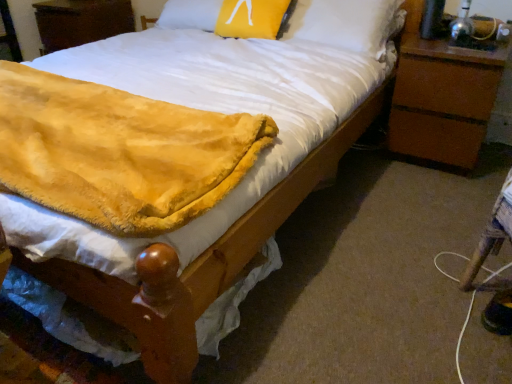
The image size is (512, 384). Describe the element at coordinates (119, 152) in the screenshot. I see `fuzzy yellow blanket at lower left` at that location.

Where is `yellow fuzzy pillow at upper center`? This screenshot has height=384, width=512. yellow fuzzy pillow at upper center is located at coordinates (253, 18).

The height and width of the screenshot is (384, 512). What do you see at coordinates (442, 96) in the screenshot? I see `brown wood nightstand at right, placed as the second nightstand when sorted from back to front` at bounding box center [442, 96].

Locate an element on the screen. The image size is (512, 384). wooden nightstand at upper left, the 1th nightstand viewed from the back is located at coordinates (81, 21).

Considering the sizes of objects brown wood nightstand at right, marked as the 1th nightstand in a bottom-to-top arrangement, and wooden nightstand at upper left, the second nightstand in the bottom-to-top sequence, in the image provided, who is thinner, brown wood nightstand at right, marked as the 1th nightstand in a bottom-to-top arrangement, or wooden nightstand at upper left, the second nightstand in the bottom-to-top sequence,?

brown wood nightstand at right, marked as the 1th nightstand in a bottom-to-top arrangement.

At what (x,y) coordinates should I click in order to perform the action: click on nightstand located behind the brown wood nightstand at right, arranged as the 2th nightstand when viewed from the top. Please return your answer as a coordinate pair (x, y). Looking at the image, I should click on click(81, 21).

Is brown wood nightstand at right, marked as the 1th nightstand in a bottom-to-top arrangement, facing away from wooden nightstand at upper left, the second nightstand in the bottom-to-top sequence?

brown wood nightstand at right, marked as the 1th nightstand in a bottom-to-top arrangement, is not turned away from wooden nightstand at upper left, the second nightstand in the bottom-to-top sequence.

Are brown wood nightstand at right, which is counted as the second nightstand, starting from the left, and wooden nightstand at upper left, positioned as the first nightstand in top-to-bottom order, beside each other?

No, brown wood nightstand at right, which is counted as the second nightstand, starting from the left, is not in contact with wooden nightstand at upper left, positioned as the first nightstand in top-to-bottom order.

From a real-world perspective, is brown wood nightstand at right, arranged as the 2th nightstand when viewed from the top, under fuzzy yellow blanket at lower left?

Yes, from a real-world perspective, brown wood nightstand at right, arranged as the 2th nightstand when viewed from the top, is below fuzzy yellow blanket at lower left.

Is brown wood nightstand at right, arranged as the 2th nightstand when viewed from the top, facing away from fuzzy yellow blanket at lower left?

brown wood nightstand at right, arranged as the 2th nightstand when viewed from the top, does not have its back to fuzzy yellow blanket at lower left.

Based on the photo, what's the angular difference between brown wood nightstand at right, marked as the 1th nightstand in a bottom-to-top arrangement, and fuzzy yellow blanket at lower left's facing directions?

There is a 0.19-degree angle between the facing directions of brown wood nightstand at right, marked as the 1th nightstand in a bottom-to-top arrangement, and fuzzy yellow blanket at lower left.

Considering the relative positions of brown wood nightstand at right, arranged as the 2th nightstand when viewed from the top, and fuzzy yellow blanket at lower left in the image provided, is brown wood nightstand at right, arranged as the 2th nightstand when viewed from the top, to the left of fuzzy yellow blanket at lower left from the viewer's perspective?

In fact, brown wood nightstand at right, arranged as the 2th nightstand when viewed from the top, is to the right of fuzzy yellow blanket at lower left.

Can you confirm if brown wood nightstand at right, marked as the 1th nightstand in a bottom-to-top arrangement, is wider than yellow fuzzy pillow at upper center?

Correct, the width of brown wood nightstand at right, marked as the 1th nightstand in a bottom-to-top arrangement, exceeds that of yellow fuzzy pillow at upper center.

Who is shorter, brown wood nightstand at right, acting as the 1th nightstand starting from the front, or yellow fuzzy pillow at upper center?

yellow fuzzy pillow at upper center is shorter.

From the picture: Is brown wood nightstand at right, acting as the 1th nightstand starting from the front, touching yellow fuzzy pillow at upper center?

No, brown wood nightstand at right, acting as the 1th nightstand starting from the front, is not with yellow fuzzy pillow at upper center.

Is wooden nightstand at upper left, the 1th nightstand viewed from the back, positioned behind fuzzy yellow blanket at lower left?

Yes, it is behind fuzzy yellow blanket at lower left.

From the image's perspective, is wooden nightstand at upper left, the second nightstand in the bottom-to-top sequence, located above or below fuzzy yellow blanket at lower left?

Clearly, from the image's perspective, wooden nightstand at upper left, the second nightstand in the bottom-to-top sequence, is above fuzzy yellow blanket at lower left.

Is wooden nightstand at upper left, the 1th nightstand viewed from the back, next to fuzzy yellow blanket at lower left?

No, wooden nightstand at upper left, the 1th nightstand viewed from the back, is not touching fuzzy yellow blanket at lower left.

Based on the photo, is wooden nightstand at upper left, the second nightstand in the bottom-to-top sequence, oriented towards fuzzy yellow blanket at lower left?

No, wooden nightstand at upper left, the second nightstand in the bottom-to-top sequence, is not aimed at fuzzy yellow blanket at lower left.

Is fuzzy yellow blanket at lower left turned away from wooden nightstand at upper left, positioned as the first nightstand in top-to-bottom order?

No.

Which of these two, fuzzy yellow blanket at lower left or wooden nightstand at upper left, the second nightstand in the bottom-to-top sequence, stands taller?

wooden nightstand at upper left, the second nightstand in the bottom-to-top sequence, is taller.

Which of these two, fuzzy yellow blanket at lower left or wooden nightstand at upper left, the 1th nightstand viewed from the back, is thinner?

wooden nightstand at upper left, the 1th nightstand viewed from the back, is thinner.

Are fuzzy yellow blanket at lower left and wooden nightstand at upper left, acting as the second nightstand starting from the front, far apart?

Yes.

Is yellow fuzzy pillow at upper center further to the viewer compared to fuzzy yellow blanket at lower left?

Yes, yellow fuzzy pillow at upper center is further from the camera.

Is yellow fuzzy pillow at upper center located outside fuzzy yellow blanket at lower left?

Yes, yellow fuzzy pillow at upper center is outside of fuzzy yellow blanket at lower left.

In the image, is yellow fuzzy pillow at upper center on the left side or the right side of fuzzy yellow blanket at lower left?

Based on their positions, yellow fuzzy pillow at upper center is located to the right of fuzzy yellow blanket at lower left.

Consider the image. Visually, is wooden nightstand at upper left, the second nightstand in the bottom-to-top sequence, positioned to the left or to the right of yellow fuzzy pillow at upper center?

Based on their positions, wooden nightstand at upper left, the second nightstand in the bottom-to-top sequence, is located to the left of yellow fuzzy pillow at upper center.

Where is `pillow in front of the wooden nightstand at upper left, placed as the second nightstand when sorted from right to left`? pillow in front of the wooden nightstand at upper left, placed as the second nightstand when sorted from right to left is located at coordinates (253, 18).

Is wooden nightstand at upper left, acting as the second nightstand starting from the front, taller than yellow fuzzy pillow at upper center?

Yes, wooden nightstand at upper left, acting as the second nightstand starting from the front, is taller than yellow fuzzy pillow at upper center.

Is the depth of wooden nightstand at upper left, positioned as the first nightstand in top-to-bottom order, less than that of yellow fuzzy pillow at upper center?

No, wooden nightstand at upper left, positioned as the first nightstand in top-to-bottom order, is behind yellow fuzzy pillow at upper center.

Identify the location of nightstand below the wooden nightstand at upper left, placed as the second nightstand when sorted from right to left (from a real-world perspective). The width and height of the screenshot is (512, 384). (442, 96).

What are the coordinates of `blanket located in front of the brown wood nightstand at right, acting as the 1th nightstand starting from the front` in the screenshot? It's located at (119, 152).

Looking at the image, which one is located closer to wooden nightstand at upper left, acting as the second nightstand starting from the front, brown wood nightstand at right, which is counted as the second nightstand, starting from the left, or fuzzy yellow blanket at lower left?

fuzzy yellow blanket at lower left.

Looking at the image, which one is located further to fuzzy yellow blanket at lower left, yellow fuzzy pillow at upper center or brown wood nightstand at right, arranged as the 2th nightstand when viewed from the top?

brown wood nightstand at right, arranged as the 2th nightstand when viewed from the top.

From the image, which object appears to be nearer to fuzzy yellow blanket at lower left, wooden nightstand at upper left, the 1th nightstand viewed from the back, or brown wood nightstand at right, which is counted as the second nightstand, starting from the left?

Based on the image, brown wood nightstand at right, which is counted as the second nightstand, starting from the left, appears to be nearer to fuzzy yellow blanket at lower left.

From the image, which object appears to be farther from brown wood nightstand at right, arranged as the 2th nightstand when viewed from the top, yellow fuzzy pillow at upper center or fuzzy yellow blanket at lower left?

The object further to brown wood nightstand at right, arranged as the 2th nightstand when viewed from the top, is fuzzy yellow blanket at lower left.

Looking at this image, considering their positions, is brown wood nightstand at right, which is counted as the first nightstand, starting from the right, positioned further to wooden nightstand at upper left, positioned as the first nightstand in top-to-bottom order, than yellow fuzzy pillow at upper center?

Based on the image, brown wood nightstand at right, which is counted as the first nightstand, starting from the right, appears to be further to wooden nightstand at upper left, positioned as the first nightstand in top-to-bottom order.

When comparing their distances from wooden nightstand at upper left, the second nightstand in the bottom-to-top sequence, does fuzzy yellow blanket at lower left or yellow fuzzy pillow at upper center seem closer?

yellow fuzzy pillow at upper center is positioned closer to the anchor wooden nightstand at upper left, the second nightstand in the bottom-to-top sequence.

Considering their positions, is brown wood nightstand at right, placed as the second nightstand when sorted from back to front, positioned closer to fuzzy yellow blanket at lower left than wooden nightstand at upper left, positioned as the first nightstand in top-to-bottom order?

brown wood nightstand at right, placed as the second nightstand when sorted from back to front, is closer to fuzzy yellow blanket at lower left.

From the image, which object appears to be farther from brown wood nightstand at right, placed as the second nightstand when sorted from back to front, yellow fuzzy pillow at upper center or wooden nightstand at upper left, the first nightstand in the left-to-right sequence?

wooden nightstand at upper left, the first nightstand in the left-to-right sequence, lies further to brown wood nightstand at right, placed as the second nightstand when sorted from back to front, than the other object.

Where is `pillow between wooden nightstand at upper left, placed as the second nightstand when sorted from right to left, and brown wood nightstand at right, marked as the 1th nightstand in a bottom-to-top arrangement, in the horizontal direction`? The image size is (512, 384). pillow between wooden nightstand at upper left, placed as the second nightstand when sorted from right to left, and brown wood nightstand at right, marked as the 1th nightstand in a bottom-to-top arrangement, in the horizontal direction is located at coordinates (253, 18).

Where is `pillow situated between fuzzy yellow blanket at lower left and brown wood nightstand at right, which is counted as the second nightstand, starting from the left, from left to right`? Image resolution: width=512 pixels, height=384 pixels. pillow situated between fuzzy yellow blanket at lower left and brown wood nightstand at right, which is counted as the second nightstand, starting from the left, from left to right is located at coordinates (253, 18).

This screenshot has width=512, height=384. What are the coordinates of `blanket between wooden nightstand at upper left, the first nightstand in the left-to-right sequence, and brown wood nightstand at right, acting as the 1th nightstand starting from the front, in the horizontal direction` in the screenshot? It's located at [119, 152].

I want to click on pillow between fuzzy yellow blanket at lower left and wooden nightstand at upper left, the second nightstand in the bottom-to-top sequence, from front to back, so [253, 18].